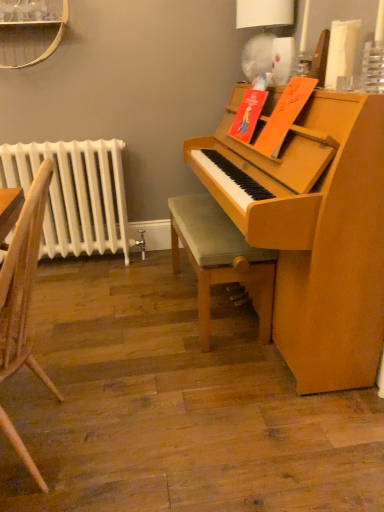
Question: Should I look upward or downward to see green fabric stool at center?

Choices:
 (A) up
 (B) down

Answer: (B)

Question: Should I look upward or downward to see white painted metal radiator at left?

Choices:
 (A) up
 (B) down

Answer: (A)

Question: Is wooden chair at left not close to white paper lampshade at upper right?

Choices:
 (A) yes
 (B) no

Answer: (A)

Question: Considering the relative sizes of wooden chair at left and white paper lampshade at upper right in the image provided, is wooden chair at left bigger than white paper lampshade at upper right?

Choices:
 (A) no
 (B) yes

Answer: (B)

Question: Would you say wooden chair at left contains white paper lampshade at upper right?

Choices:
 (A) no
 (B) yes

Answer: (A)

Question: Does wooden chair at left have a smaller size compared to white paper lampshade at upper right?

Choices:
 (A) yes
 (B) no

Answer: (B)

Question: Does wooden chair at left have a greater height compared to white paper lampshade at upper right?

Choices:
 (A) yes
 (B) no

Answer: (A)

Question: From the image's perspective, does wooden chair at left appear higher than white paper lampshade at upper right?

Choices:
 (A) no
 (B) yes

Answer: (A)

Question: Does wooden chair at left turn towards white painted metal radiator at left?

Choices:
 (A) yes
 (B) no

Answer: (B)

Question: From the image's perspective, is wooden chair at left over white painted metal radiator at left?

Choices:
 (A) no
 (B) yes

Answer: (A)

Question: Is wooden chair at left thinner than white painted metal radiator at left?

Choices:
 (A) no
 (B) yes

Answer: (A)

Question: Is wooden chair at left looking in the opposite direction of white painted metal radiator at left?

Choices:
 (A) yes
 (B) no

Answer: (B)

Question: Can you confirm if wooden chair at left is taller than white painted metal radiator at left?

Choices:
 (A) no
 (B) yes

Answer: (B)

Question: Is wooden chair at left outside white painted metal radiator at left?

Choices:
 (A) yes
 (B) no

Answer: (A)

Question: Is the position of white paper lampshade at upper right less distant than that of wooden chair at left?

Choices:
 (A) yes
 (B) no

Answer: (B)